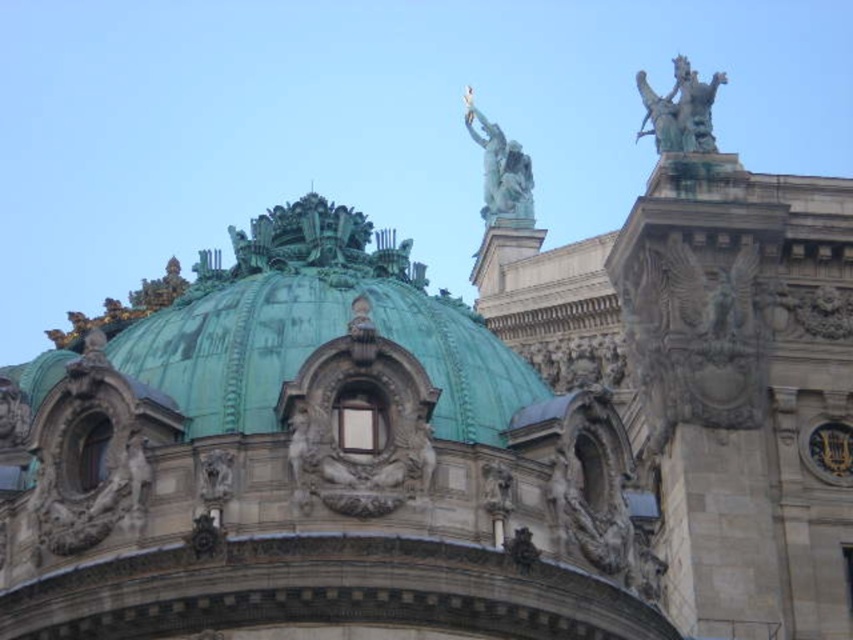
Question: Does green patina statue at upper right have a smaller size compared to green patina statue at upper center?

Choices:
 (A) no
 (B) yes

Answer: (B)

Question: Does green patina dome at center have a lesser width compared to green patina statue at upper center?

Choices:
 (A) no
 (B) yes

Answer: (A)

Question: Which is nearer to the green patina statue at upper center?

Choices:
 (A) green patina statue at upper right
 (B) green patina dome at center

Answer: (A)

Question: Is green patina statue at upper right below green patina statue at upper center?

Choices:
 (A) no
 (B) yes

Answer: (B)

Question: Which object is the farthest from the green patina statue at upper center?

Choices:
 (A) green patina dome at center
 (B) green patina statue at upper right

Answer: (A)

Question: Which point is farther to the camera?

Choices:
 (A) (697, 92)
 (B) (242, 330)
 (C) (480, 141)

Answer: (C)